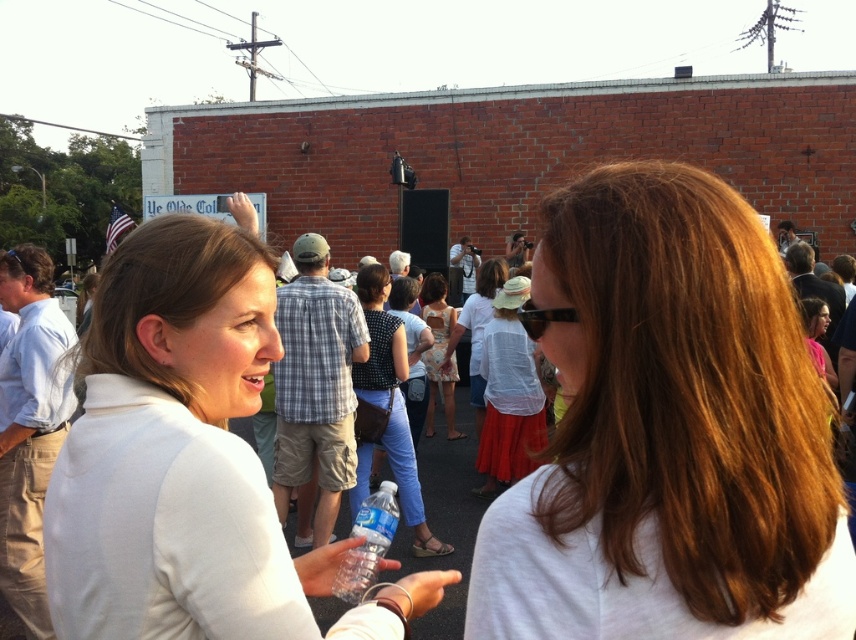
Who is taller, black textured blouse at center or clear plastic water bottle at center?

With more height is black textured blouse at center.

What do you see at coordinates (390, 401) in the screenshot? The width and height of the screenshot is (856, 640). I see `black textured blouse at center` at bounding box center [390, 401].

Describe the element at coordinates (390, 401) in the screenshot. I see `black textured blouse at center` at that location.

At what (x,y) coordinates should I click in order to perform the action: click on black textured blouse at center. Please return your answer as a coordinate pair (x, y). The height and width of the screenshot is (640, 856). Looking at the image, I should click on (390, 401).

Between white matte shirt at center and clear plastic water bottle at center, which one is positioned lower?

clear plastic water bottle at center is below.

Is white matte shirt at center shorter than clear plastic water bottle at center?

No.

Who is more forward, (163,616) or (361,556)?

Point (163,616) is more forward.

Find the location of a particular element. white matte shirt at center is located at coordinates point(187,461).

Who is taller, shiny brown hair at center or clear plastic water bottle at center?

With more height is shiny brown hair at center.

Who is shorter, shiny brown hair at center or clear plastic water bottle at center?

With less height is clear plastic water bottle at center.

Is point (697, 561) farther from viewer compared to point (349, 592)?

That is False.

Where is `shiny brown hair at center`? This screenshot has height=640, width=856. shiny brown hair at center is located at coordinates (669, 433).